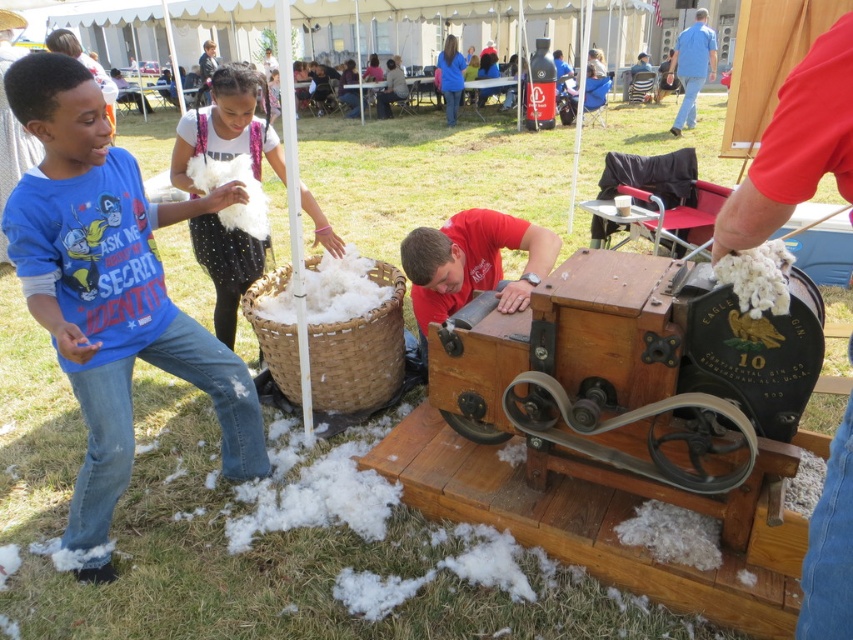
Does point (115, 337) lie behind point (242, 278)?

No, it is in front of (242, 278).

Find the location of a particular element. blue cotton shirt at left is located at coordinates (109, 285).

Where is `blue cotton shirt at left`? blue cotton shirt at left is located at coordinates [x=109, y=285].

This screenshot has width=853, height=640. I want to click on blue cotton shirt at left, so click(109, 285).

Between blue cotton shirt at left and blue cotton shirt at upper right, which one appears on the left side from the viewer's perspective?

blue cotton shirt at left is more to the left.

Is the position of blue cotton shirt at left more distant than that of blue cotton shirt at upper right?

No, it is in front of blue cotton shirt at upper right.

Does point (128, 188) come farther from viewer compared to point (695, 44)?

No, it is in front of (695, 44).

I want to click on blue cotton shirt at left, so click(x=109, y=285).

From the picture: Is white fluffy cotton at center bigger than blue cotton shirt at upper right?

Actually, white fluffy cotton at center might be smaller than blue cotton shirt at upper right.

The height and width of the screenshot is (640, 853). What are the coordinates of `white fluffy cotton at center` in the screenshot? It's located at (228, 125).

You are a GUI agent. You are given a task and a screenshot of the screen. Output one action in this format:
    pyautogui.click(x=<x>, y=<y>)
    Task: Click on the white fluffy cotton at center
    
    Given the screenshot: What is the action you would take?
    pyautogui.click(x=228, y=125)